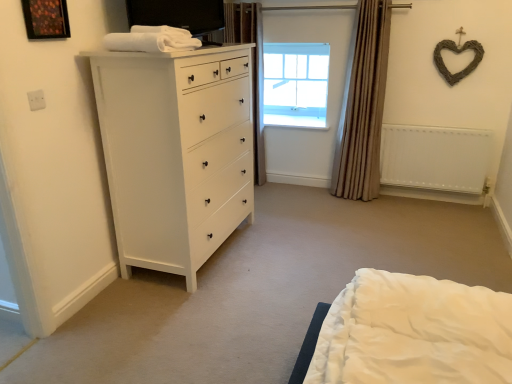
Find the location of a particular element. This screenshot has width=512, height=384. unoccupied area in front of white matte chest of drawers at left is located at coordinates [x=180, y=318].